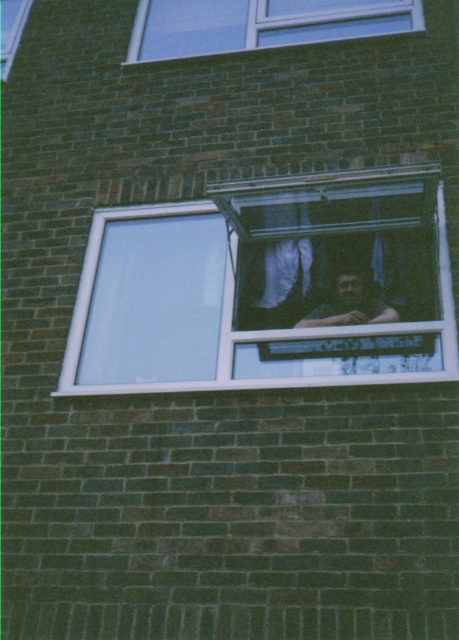
You are standing outside the brick building and want to see the person with dark brown hair at center. Can you see them through the transparent glass window at upper center?

The transparent glass window at upper center is much taller than the dark brown hair at center, so the person with dark brown hair at center is below the window. Therefore, you can see them through the transparent glass window at upper center.